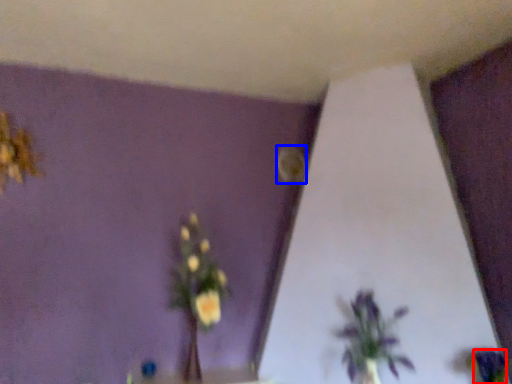
Question: Which object appears closest to the camera in this image, flower (highlighted by a red box) or flower (highlighted by a blue box)?

Choices:
 (A) flower
 (B) flower

Answer: (A)